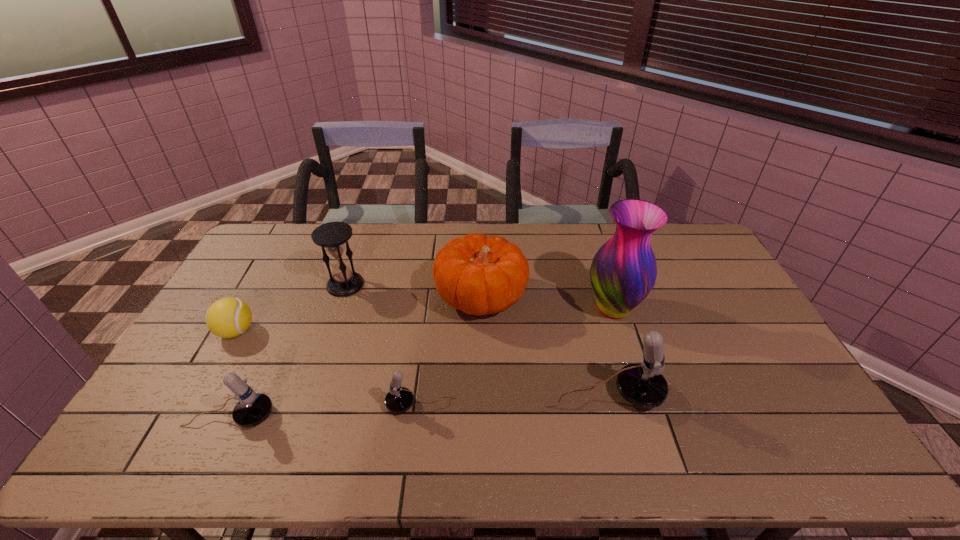
In the current image, all microphones are evenly spaced. To maintain this equal spacing, where should an additional microphone be placed on the right? Please point out a free spot. Please provide its 2D coordinates. Your answer should be formatted as a tuple, i.e. [(x, y)], where the tuple contains the x and y coordinates of a point satisfying the conditions above.

[(779, 384)]